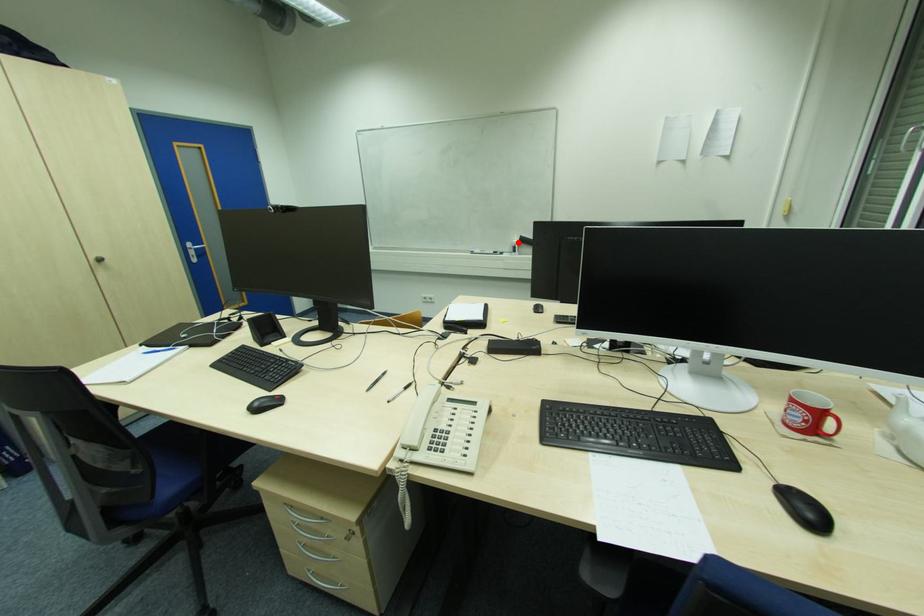
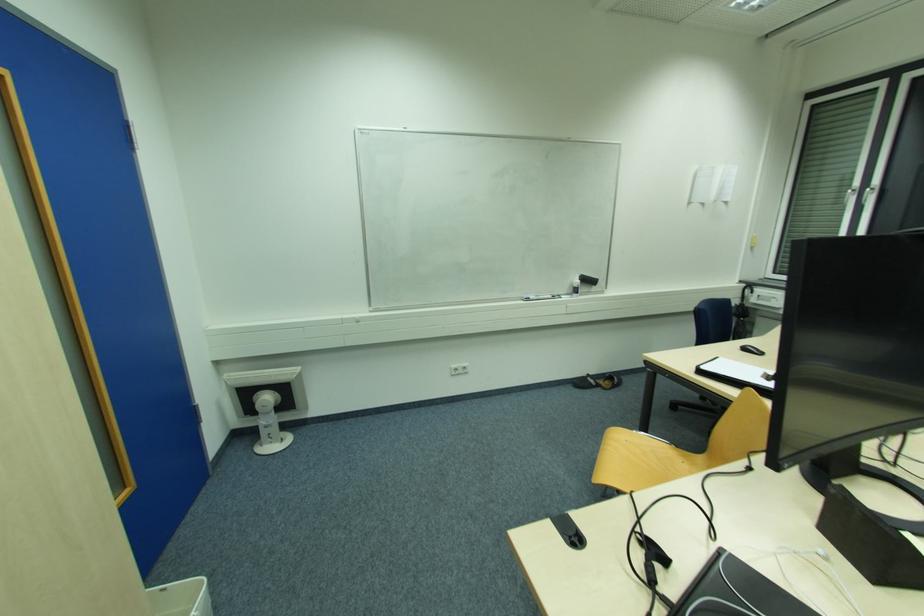
The point at the highlighted location is marked in the first image. Where is the corresponding point in the second image?

(578, 282)